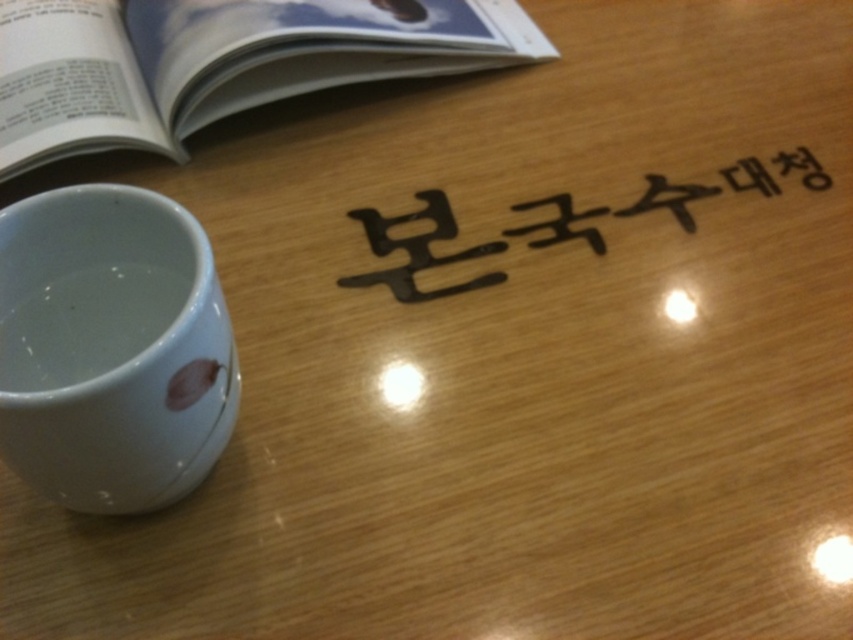
Is point (181, 260) closer to viewer compared to point (144, 17)?

Yes, point (181, 260) is in front of point (144, 17).

Does white glossy mug at lower left have a greater width compared to matte paper book at upper left?

Incorrect, white glossy mug at lower left's width does not surpass matte paper book at upper left's.

Locate an element on the screen. Image resolution: width=853 pixels, height=640 pixels. white glossy mug at lower left is located at coordinates (111, 348).

Where is `white glossy mug at lower left`? Image resolution: width=853 pixels, height=640 pixels. white glossy mug at lower left is located at coordinates (111, 348).

Measure the distance from matte paper book at upper left to black matte sign at center.

They are 14.27 inches apart.

This screenshot has height=640, width=853. Describe the element at coordinates (218, 61) in the screenshot. I see `matte paper book at upper left` at that location.

Is point (280, 17) positioned after point (590, 209)?

That is True.

You are a GUI agent. You are given a task and a screenshot of the screen. Output one action in this format:
    pyautogui.click(x=<x>, y=<y>)
    Task: Click on the matte paper book at upper left
    The height and width of the screenshot is (640, 853).
    Given the screenshot: What is the action you would take?
    pyautogui.click(x=218, y=61)

Is point (64, 356) closer to camera compared to point (381, 248)?

Yes, point (64, 356) is in front of point (381, 248).

Is white glossy mug at lower left taller than black matte sign at center?

Yes.

Does point (20, 458) lie in front of point (403, 291)?

Yes, point (20, 458) is in front of point (403, 291).

Where is `white glossy mug at lower left`? The width and height of the screenshot is (853, 640). white glossy mug at lower left is located at coordinates (111, 348).